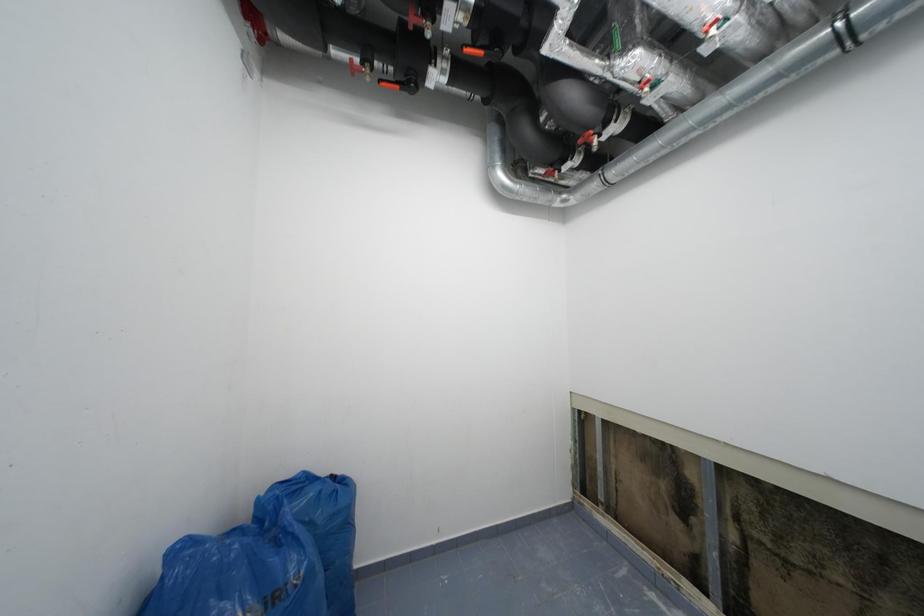
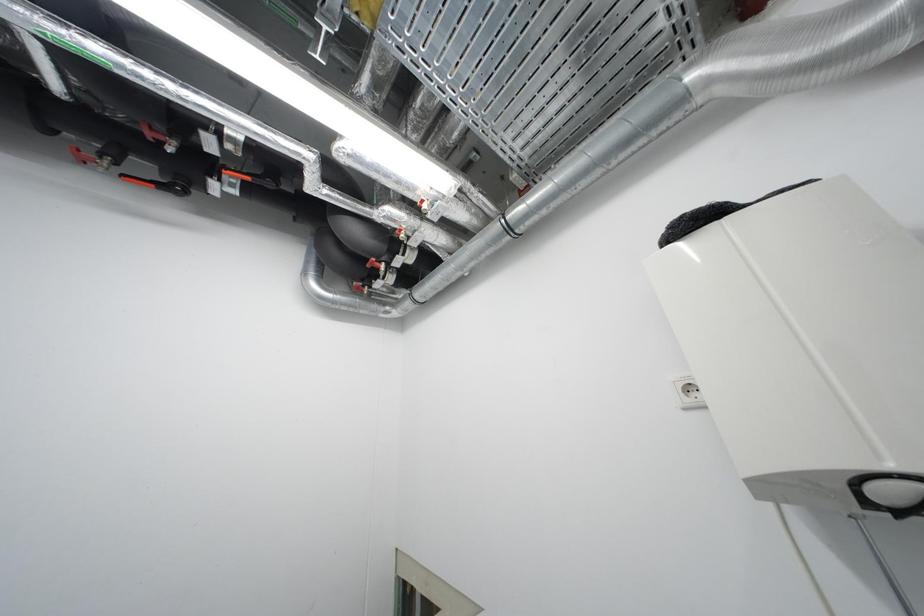
Question: The images are taken continuously from a first-person perspective. In which direction are you moving?

Choices:
 (A) Left
 (B) Right
 (C) Forward
 (D) Backward

Answer: (B)